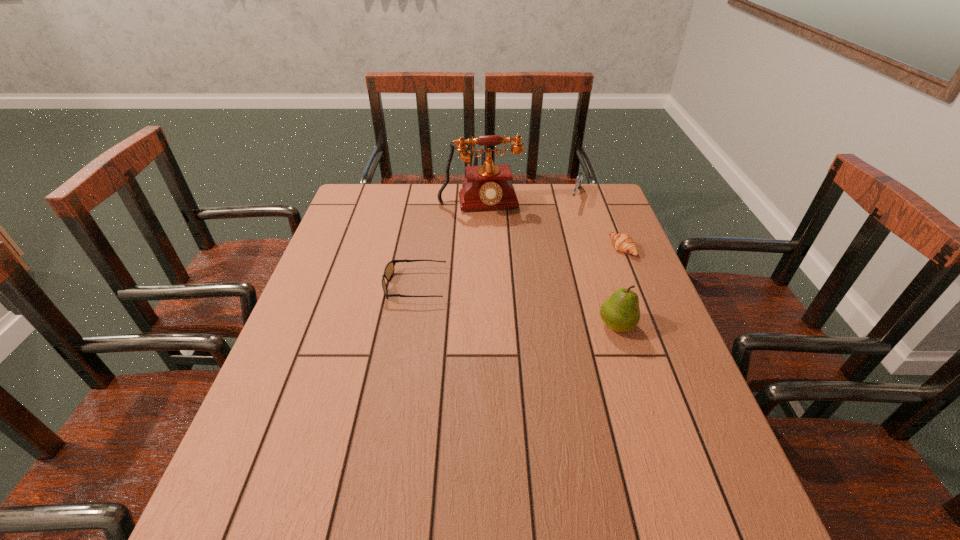
I want to click on free space at the far right corner of the desktop, so click(593, 193).

This screenshot has height=540, width=960. In order to click on empty space that is in between the fourth shortest object and the pastry in this screenshot , I will do `click(619, 287)`.

Identify the location of free space between the pistol and the nearest object. (596, 262).

The image size is (960, 540). In order to click on free space that is in between the pear and the telephone in this screenshot , I will do `click(548, 266)`.

The width and height of the screenshot is (960, 540). I want to click on blank region between the pistol and the second tallest object, so click(x=596, y=262).

Where is `unoccupied position between the third tallest object and the tallest object`? The width and height of the screenshot is (960, 540). unoccupied position between the third tallest object and the tallest object is located at coordinates (528, 202).

This screenshot has width=960, height=540. I want to click on empty space that is in between the third shortest object and the tallest object, so click(x=528, y=202).

Where is `vacant area that lies between the pastry and the second tallest object`? This screenshot has width=960, height=540. vacant area that lies between the pastry and the second tallest object is located at coordinates (619, 287).

Find the location of a particular element. vacant space that is in between the fourth farthest object and the third shortest object is located at coordinates (495, 242).

Where is `empty space that is in between the pear and the pastry`? empty space that is in between the pear and the pastry is located at coordinates (619, 287).